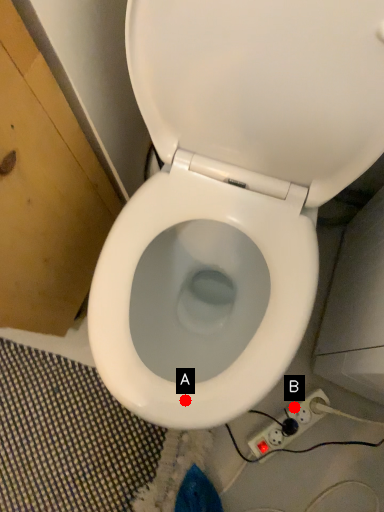
Question: Two points are circled on the image, labeled by A and B beside each circle. Which point is farther from the camera taking this photo?

Choices:
 (A) A is further
 (B) B is further

Answer: (B)